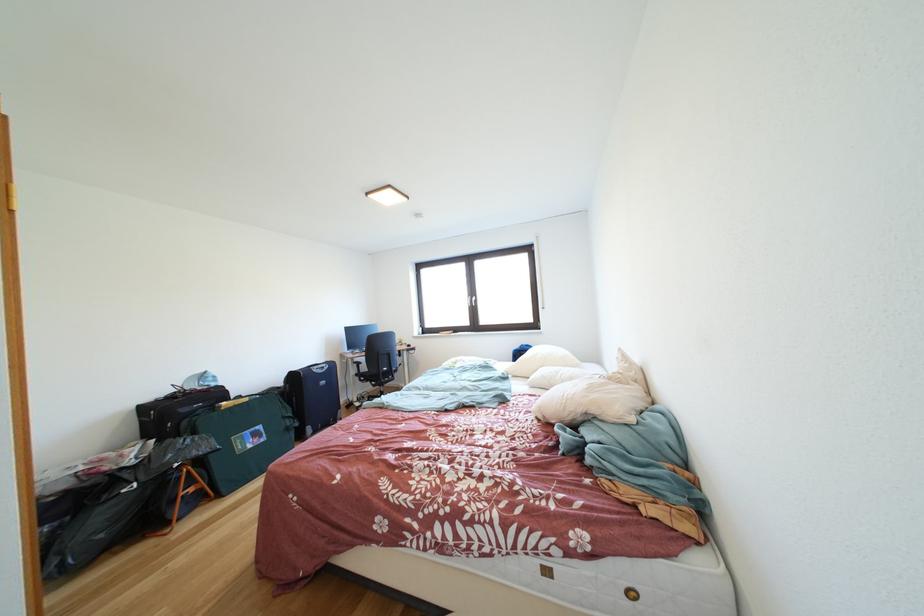
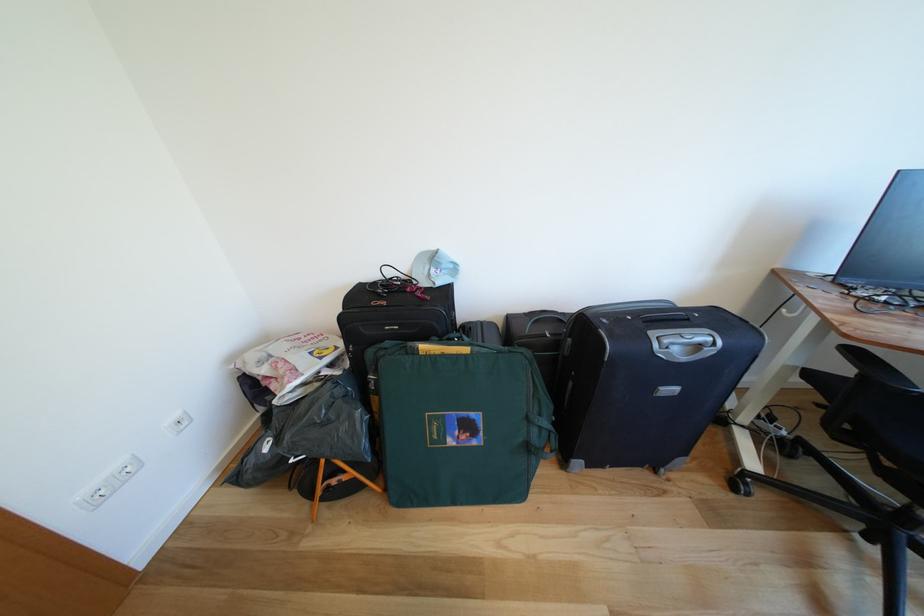
Locate, in the second image, the point that corresponds to point 211,379 in the first image.

(442, 262)